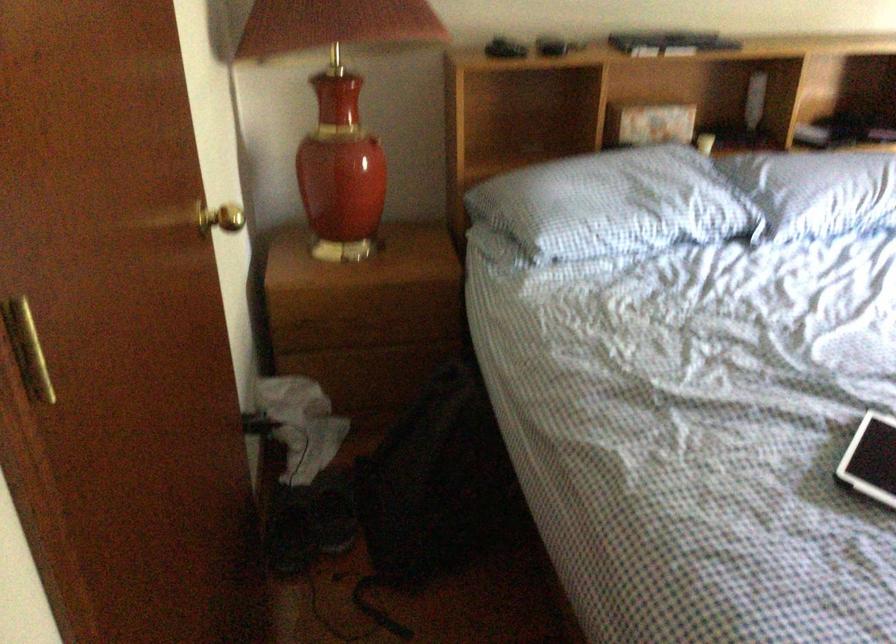
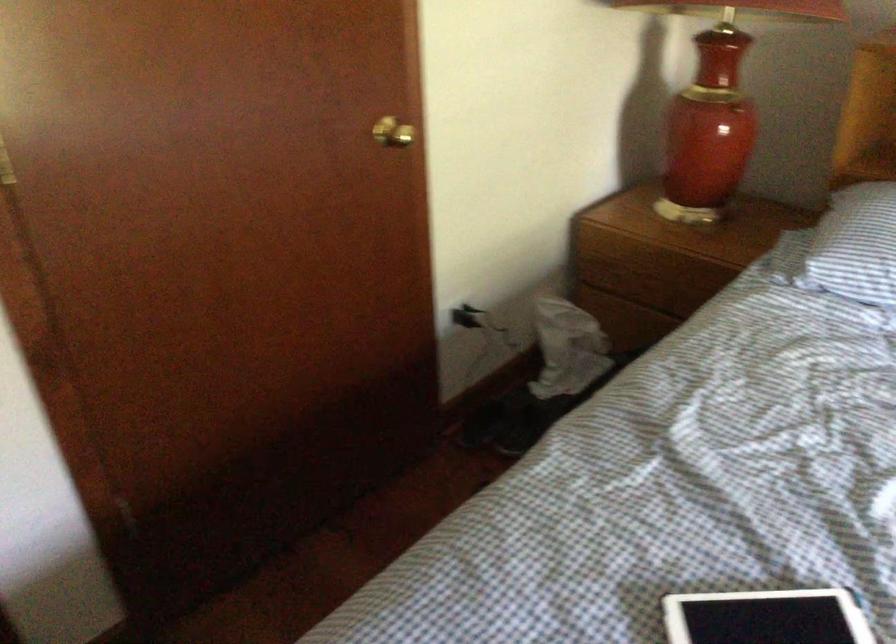
Question: The images are taken continuously from a first-person perspective. In which direction is your viewpoint rotating?

Choices:
 (A) Left
 (B) Right
 (C) Up
 (D) Down

Answer: (A)